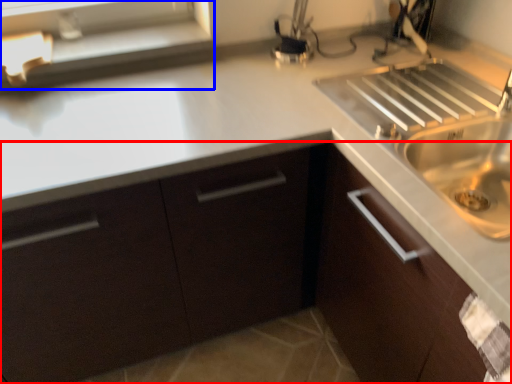
Question: Which of the following is the farthest to the observer, cabinetry (highlighted by a red box) or window sill (highlighted by a blue box)?

Choices:
 (A) cabinetry
 (B) window sill

Answer: (B)